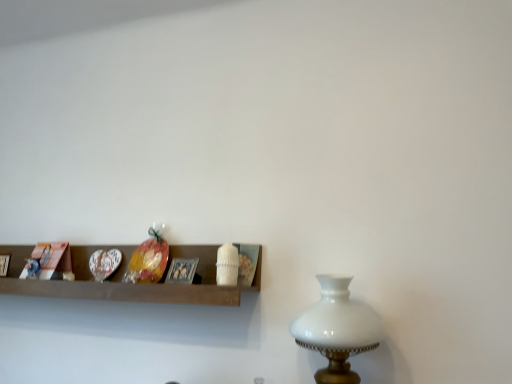
The width and height of the screenshot is (512, 384). What do you see at coordinates (182, 271) in the screenshot?
I see `metallic silver picture frame at center` at bounding box center [182, 271].

This screenshot has width=512, height=384. In order to click on wooden shelf at center in this screenshot , I will do `click(127, 284)`.

The width and height of the screenshot is (512, 384). Find the location of `white glass table lamp at right`. white glass table lamp at right is located at coordinates (337, 329).

Is wooden shelf at center positioned with its back to white glass table lamp at right?

No, wooden shelf at center's orientation is not away from white glass table lamp at right.

Which point is more distant from viewer, (82, 248) or (360, 321)?

The point (82, 248) is farther.

Can you confirm if wooden shelf at center is bigger than white glass table lamp at right?

Correct, wooden shelf at center is larger in size than white glass table lamp at right.

Is wooden shelf at center inside metallic silver picture frame at center?

No.

Which of these two, metallic silver picture frame at center or wooden shelf at center, is smaller?

Smaller between the two is metallic silver picture frame at center.

Is metallic silver picture frame at center facing towards wooden shelf at center?

Yes, metallic silver picture frame at center is oriented towards wooden shelf at center.

Considering the positions of point (170, 262) and point (75, 257), is point (170, 262) closer or farther from the camera than point (75, 257)?

Point (170, 262) is closer to the camera than point (75, 257).

Does white glass table lamp at right have a greater height compared to metallic silver picture frame at center?

Indeed, white glass table lamp at right has a greater height compared to metallic silver picture frame at center.

Image resolution: width=512 pixels, height=384 pixels. What are the coordinates of `table lamp that is under the metallic silver picture frame at center (from a real-world perspective)` in the screenshot? It's located at (337, 329).

Considering the positions of objects white glass table lamp at right and metallic silver picture frame at center in the image provided, who is more to the left, white glass table lamp at right or metallic silver picture frame at center?

metallic silver picture frame at center is more to the left.

From a real-world perspective, is white glass table lamp at right below metallic silver picture frame at center?

Correct, in the physical world, white glass table lamp at right is lower than metallic silver picture frame at center.

Who is smaller, metallic silver picture frame at center or white glass table lamp at right?

metallic silver picture frame at center.

Measure the distance from metallic silver picture frame at center to white glass table lamp at right.

metallic silver picture frame at center is 21.64 inches away from white glass table lamp at right.

Considering the sizes of metallic silver picture frame at center and white glass table lamp at right in the image, is metallic silver picture frame at center taller or shorter than white glass table lamp at right?

In the image, metallic silver picture frame at center appears to be shorter than white glass table lamp at right.

Can you confirm if metallic silver picture frame at center is positioned to the left of white glass table lamp at right?

Correct, you'll find metallic silver picture frame at center to the left of white glass table lamp at right.

I want to click on shelf below the metallic silver picture frame at center (from the image's perspective), so click(x=127, y=284).

Is wooden shelf at center wider or thinner than metallic silver picture frame at center?

Considering their sizes, wooden shelf at center looks broader than metallic silver picture frame at center.

From a real-world perspective, which is physically above, wooden shelf at center or metallic silver picture frame at center?

From a 3D spatial view, metallic silver picture frame at center is above.

Would you say wooden shelf at center is inside or outside metallic silver picture frame at center?

wooden shelf at center lies outside metallic silver picture frame at center.

Is there a large distance between white glass table lamp at right and wooden shelf at center?

That's not correct — white glass table lamp at right is a little close to wooden shelf at center.

Is white glass table lamp at right to the left of wooden shelf at center from the viewer's perspective?

No.

Can we say white glass table lamp at right lies outside wooden shelf at center?

Yes, white glass table lamp at right is outside of wooden shelf at center.

I want to click on shelf above the white glass table lamp at right (from the image's perspective), so click(x=127, y=284).

Locate an element on the screen. The image size is (512, 384). shelf located underneath the metallic silver picture frame at center (from a real-world perspective) is located at coordinates (127, 284).

Looking at the image, which one is located closer to wooden shelf at center, white glass table lamp at right or metallic silver picture frame at center?

metallic silver picture frame at center.

From the image, which object appears to be farther from wooden shelf at center, metallic silver picture frame at center or white glass table lamp at right?

white glass table lamp at right is positioned further to the anchor wooden shelf at center.

Which object lies nearer to the anchor point white glass table lamp at right, wooden shelf at center or metallic silver picture frame at center?

Among the two, wooden shelf at center is located nearer to white glass table lamp at right.

Based on their spatial positions, is white glass table lamp at right or wooden shelf at center closer to metallic silver picture frame at center?

The object closer to metallic silver picture frame at center is wooden shelf at center.

Looking at the image, which one is located closer to white glass table lamp at right, metallic silver picture frame at center or wooden shelf at center?

wooden shelf at center.

Looking at the image, which one is located closer to metallic silver picture frame at center, wooden shelf at center or white glass table lamp at right?

Based on the image, wooden shelf at center appears to be nearer to metallic silver picture frame at center.

This screenshot has height=384, width=512. Find the location of `picture frame located between wooden shelf at center and white glass table lamp at right in the left-right direction`. picture frame located between wooden shelf at center and white glass table lamp at right in the left-right direction is located at coordinates (182, 271).